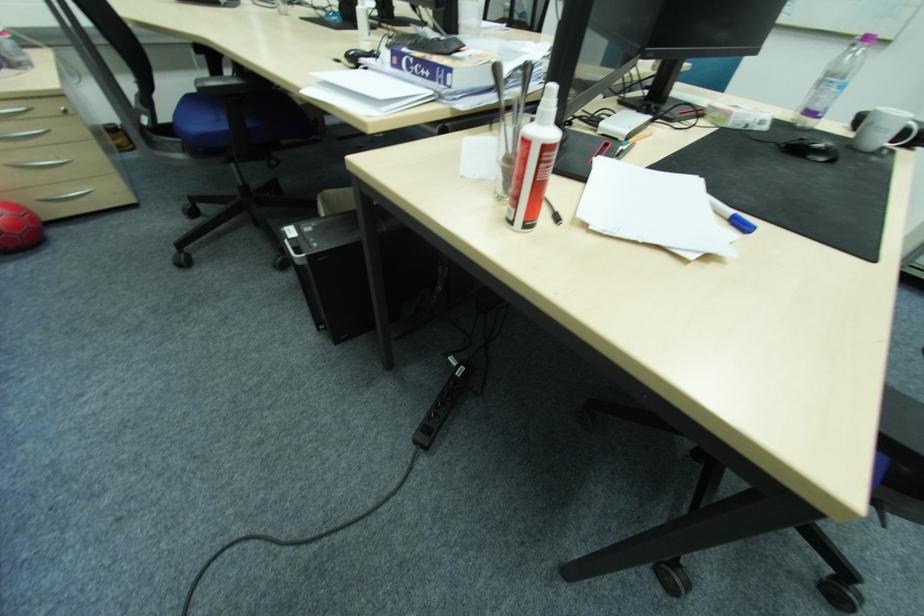
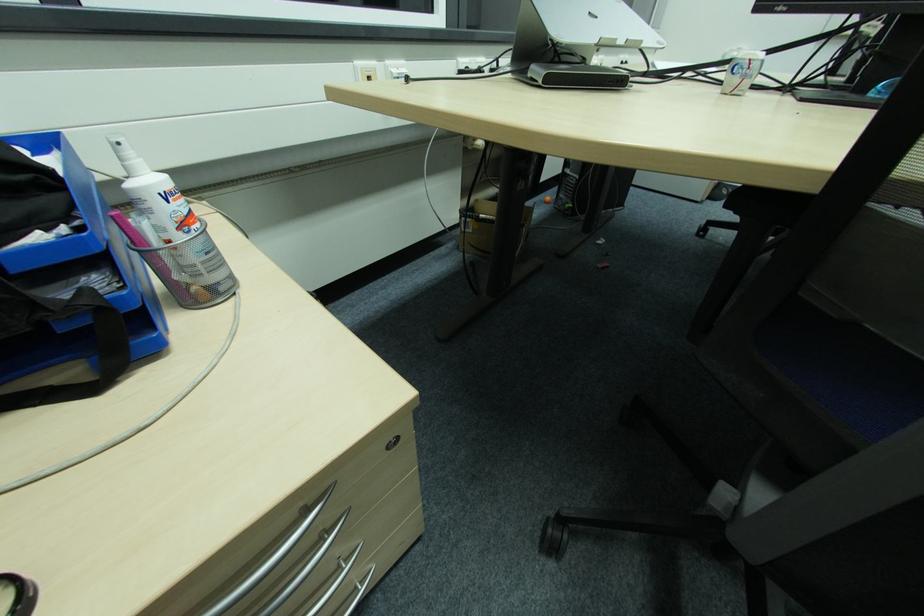
The images are taken continuously from a first-person perspective. In which direction are you moving?

The movement direction of the cameraman is left, forward.